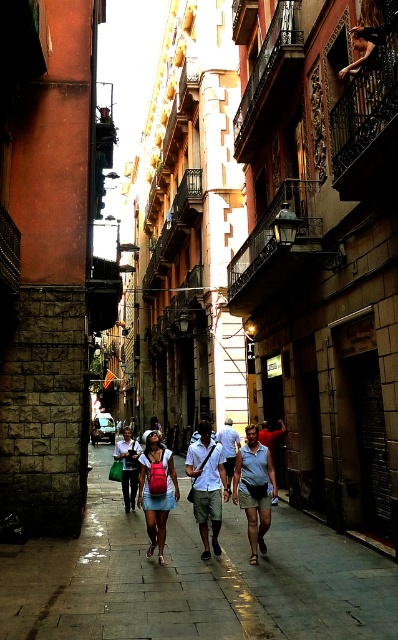
In the scene shown: You are a delivery person who needs to place a heavy box on the ground. You see the smooth concrete pavement at center and the white cotton shirt at center. Which surface is suitable for placing the box?

The smooth concrete pavement at center is suitable for placing the heavy box because it is positioned under the white cotton shirt at center, indicating it is a stable, flat surface.